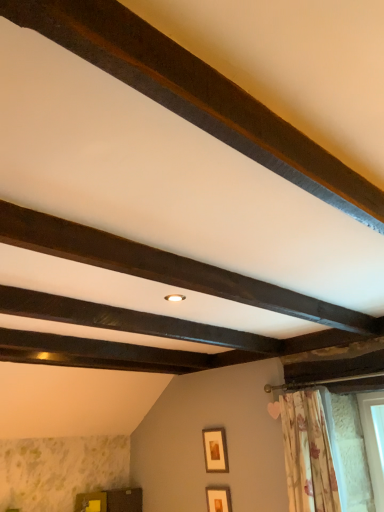
The height and width of the screenshot is (512, 384). What do you see at coordinates (308, 454) in the screenshot? I see `floral fabric curtain at lower right` at bounding box center [308, 454].

The image size is (384, 512). What do you see at coordinates (110, 501) in the screenshot?
I see `wooden cabinet at lower left` at bounding box center [110, 501].

This screenshot has height=512, width=384. I want to click on wooden cabinet at lower left, so click(x=110, y=501).

How much space does dark wood beam at center, marked as the 1th plank in a back-to-front arrangement, occupy vertically?

dark wood beam at center, marked as the 1th plank in a back-to-front arrangement, is 4.69 inches tall.

Where is `matte gold picture frame at lower center, which is the first picture frame in bottom-to-top order`? This screenshot has height=512, width=384. matte gold picture frame at lower center, which is the first picture frame in bottom-to-top order is located at coordinates (218, 499).

In the image, is floral fabric curtain at lower right positioned in front of or behind wooden cabinet at lower left?

floral fabric curtain at lower right is in front of wooden cabinet at lower left.

Considering the relative sizes of floral fabric curtain at lower right and wooden cabinet at lower left in the image provided, is floral fabric curtain at lower right thinner than wooden cabinet at lower left?

In fact, floral fabric curtain at lower right might be wider than wooden cabinet at lower left.

Is floral fabric curtain at lower right facing away from wooden cabinet at lower left?

floral fabric curtain at lower right is not turned away from wooden cabinet at lower left.

Does point (288, 492) come in front of point (104, 505)?

Yes, point (288, 492) is closer to viewer.

Is wooden picture frame at center, the first picture frame when ordered from top to bottom, at the right side of wooden cabinet at lower left?

Indeed, wooden picture frame at center, the first picture frame when ordered from top to bottom, is positioned on the right side of wooden cabinet at lower left.

Which is in front, wooden picture frame at center, arranged as the second picture frame when ordered from the bottom, or wooden cabinet at lower left?

wooden picture frame at center, arranged as the second picture frame when ordered from the bottom, is closer to the camera.

Which point is more forward, (207, 437) or (134, 489)?

The point (207, 437) is more forward.

Is floral fabric curtain at lower right positioned beyond the bounds of dark wood beam at center, the second plank viewed from the top?

floral fabric curtain at lower right is positioned outside dark wood beam at center, the second plank viewed from the top.

Which of these two, floral fabric curtain at lower right or dark wood beam at center, which is the 2th plank from front to back, is wider?

floral fabric curtain at lower right.

Based on the photo, is matte gold picture frame at lower center, which is the first picture frame in bottom-to-top order, spatially inside floral fabric curtain at lower right, or outside of it?

matte gold picture frame at lower center, which is the first picture frame in bottom-to-top order, cannot be found inside floral fabric curtain at lower right.

Is point (228, 490) positioned behind point (280, 408)?

Yes, it is.

From a real-world perspective, relative to floral fabric curtain at lower right, is matte gold picture frame at lower center, arranged as the second picture frame when viewed from the top, vertically above or below?

Clearly, from a real-world perspective, matte gold picture frame at lower center, arranged as the second picture frame when viewed from the top, is below floral fabric curtain at lower right.

Does matte gold picture frame at lower center, which is the first picture frame in bottom-to-top order, have a greater height compared to floral fabric curtain at lower right?

In fact, matte gold picture frame at lower center, which is the first picture frame in bottom-to-top order, may be shorter than floral fabric curtain at lower right.

Considering the positions of objects floral fabric curtain at lower right and dark brown wood at upper center, the 1th plank from the top, in the image provided, who is in front, floral fabric curtain at lower right or dark brown wood at upper center, the 1th plank from the top,?

dark brown wood at upper center, the 1th plank from the top.

Which object is positioned more to the left, floral fabric curtain at lower right or dark brown wood at upper center, positioned as the first plank in front-to-back order?

dark brown wood at upper center, positioned as the first plank in front-to-back order, is more to the left.

How distant is floral fabric curtain at lower right from dark brown wood at upper center, positioned as the second plank in bottom-to-top order?

The distance of floral fabric curtain at lower right from dark brown wood at upper center, positioned as the second plank in bottom-to-top order, is 1.87 meters.

Does floral fabric curtain at lower right have a smaller size compared to dark brown wood at upper center, positioned as the second plank in bottom-to-top order?

No, floral fabric curtain at lower right is not smaller than dark brown wood at upper center, positioned as the second plank in bottom-to-top order.

Which is more to the left, dark wood beam at center, which is the 2th plank from front to back, or dark brown wood at upper center, positioned as the second plank in bottom-to-top order?

From the viewer's perspective, dark brown wood at upper center, positioned as the second plank in bottom-to-top order, appears more on the left side.

Identify the location of plank lying in front of the dark wood beam at center, which is the 2th plank from front to back. (197, 96).

Is dark wood beam at center, the second plank viewed from the top, taller than dark brown wood at upper center, positioned as the second plank in bottom-to-top order?

No, dark wood beam at center, the second plank viewed from the top, is not taller than dark brown wood at upper center, positioned as the second plank in bottom-to-top order.

Between dark wood beam at center, marked as the 1th plank in a back-to-front arrangement, and dark brown wood at upper center, the 1th plank from the top, which one has larger width?

dark brown wood at upper center, the 1th plank from the top, is wider.

From a real-world perspective, is dark wood beam at center, the second plank viewed from the top, on top of matte gold picture frame at lower center, which is the first picture frame in bottom-to-top order?

Indeed, from a real-world perspective, dark wood beam at center, the second plank viewed from the top, stands above matte gold picture frame at lower center, which is the first picture frame in bottom-to-top order.

Between dark wood beam at center, marked as the 1th plank in a back-to-front arrangement, and matte gold picture frame at lower center, arranged as the second picture frame when viewed from the top, which one is positioned in front?

dark wood beam at center, marked as the 1th plank in a back-to-front arrangement.

From the image's perspective, which is above, dark wood beam at center, which is the 2th plank from front to back, or matte gold picture frame at lower center, arranged as the second picture frame when viewed from the top?

dark wood beam at center, which is the 2th plank from front to back, appears higher in the image.

Is dark wood beam at center, the 1th plank in the bottom-to-top sequence, located outside matte gold picture frame at lower center, which is the first picture frame in bottom-to-top order?

Yes.

This screenshot has width=384, height=512. What are the coordinates of `furniture behind the floral fabric curtain at lower right` in the screenshot? It's located at (110, 501).

Locate an element on the screen. This screenshot has height=512, width=384. furniture located below the wooden picture frame at center, the first picture frame when ordered from top to bottom (from the image's perspective) is located at coordinates (110, 501).

Which object lies further to the anchor point wooden picture frame at center, the first picture frame when ordered from top to bottom, wooden cabinet at lower left or dark wood beam at center, which is the 2th plank from front to back?

The object further to wooden picture frame at center, the first picture frame when ordered from top to bottom, is dark wood beam at center, which is the 2th plank from front to back.

When comparing their distances from dark wood beam at center, the 1th plank in the bottom-to-top sequence, does dark brown wood at upper center, the 2th plank viewed from the back, or wooden cabinet at lower left seem closer?

dark brown wood at upper center, the 2th plank viewed from the back.

Looking at the image, which one is located closer to dark brown wood at upper center, positioned as the first plank in front-to-back order, matte gold picture frame at lower center, arranged as the second picture frame when viewed from the top, or wooden cabinet at lower left?

Based on the image, matte gold picture frame at lower center, arranged as the second picture frame when viewed from the top, appears to be nearer to dark brown wood at upper center, positioned as the first plank in front-to-back order.

Estimate the real-world distances between objects in this image. Which object is closer to dark brown wood at upper center, positioned as the second plank in bottom-to-top order, dark wood beam at center, the 1th plank in the bottom-to-top sequence, or matte gold picture frame at lower center, arranged as the second picture frame when viewed from the top?

dark wood beam at center, the 1th plank in the bottom-to-top sequence, is closer to dark brown wood at upper center, positioned as the second plank in bottom-to-top order.

When comparing their distances from wooden picture frame at center, the first picture frame when ordered from top to bottom, does dark wood beam at center, which is the 2th plank from front to back, or floral fabric curtain at lower right seem further?

dark wood beam at center, which is the 2th plank from front to back, lies further to wooden picture frame at center, the first picture frame when ordered from top to bottom, than the other object.

Considering their positions, is dark brown wood at upper center, positioned as the first plank in front-to-back order, positioned further to wooden cabinet at lower left than dark wood beam at center, the second plank viewed from the top?

dark brown wood at upper center, positioned as the first plank in front-to-back order.

When comparing their distances from matte gold picture frame at lower center, arranged as the second picture frame when viewed from the top, does wooden picture frame at center, the first picture frame when ordered from top to bottom, or floral fabric curtain at lower right seem further?

floral fabric curtain at lower right is further to matte gold picture frame at lower center, arranged as the second picture frame when viewed from the top.

Looking at the image, which one is located closer to wooden cabinet at lower left, dark brown wood at upper center, the 1th plank from the top, or wooden picture frame at center, arranged as the second picture frame when ordered from the bottom?

wooden picture frame at center, arranged as the second picture frame when ordered from the bottom, is closer to wooden cabinet at lower left.

This screenshot has height=512, width=384. In order to click on curtain between dark brown wood at upper center, the 1th plank from the top, and wooden picture frame at center, the first picture frame when ordered from top to bottom, from front to back in this screenshot , I will do click(308, 454).

Identify the location of picture frame between dark brown wood at upper center, positioned as the first plank in front-to-back order, and wooden picture frame at center, arranged as the second picture frame when ordered from the bottom, in the front-back direction. (218, 499).

The image size is (384, 512). Identify the location of picture frame situated between wooden cabinet at lower left and matte gold picture frame at lower center, which is the first picture frame in bottom-to-top order, from left to right. (215, 450).

Image resolution: width=384 pixels, height=512 pixels. In order to click on plank between dark brown wood at upper center, positioned as the first plank in front-to-back order, and wooden cabinet at lower left in the front-back direction in this screenshot , I will do `click(165, 267)`.